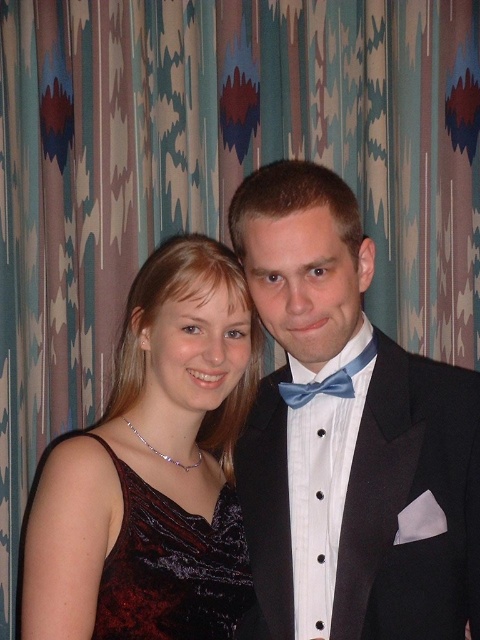
Question: Is velvet dress at left above velvet dark red dress at center?

Choices:
 (A) yes
 (B) no

Answer: (A)

Question: Which point appears closest to the camera in this image?

Choices:
 (A) (92, 541)
 (B) (305, 394)
 (C) (360, 524)
 (D) (252, 605)

Answer: (A)

Question: Does velvet dark red dress at center appear on the left side of blue satin bow tie at center?

Choices:
 (A) yes
 (B) no

Answer: (A)

Question: Is satin black suit at center smaller than velvet dark red dress at center?

Choices:
 (A) yes
 (B) no

Answer: (B)

Question: Which of the following is the farthest from the observer?

Choices:
 (A) (110, 577)
 (B) (298, 388)

Answer: (B)

Question: Among these objects, which one is nearest to the camera?

Choices:
 (A) velvet dress at left
 (B) velvet dark red dress at center
 (C) satin black suit at center

Answer: (A)